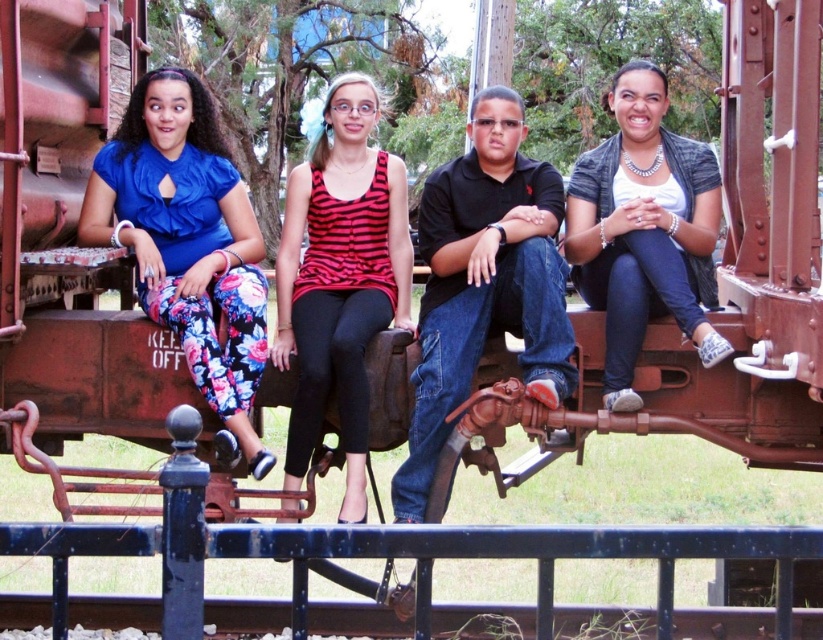
You are standing near the blue painted metal rail at lower center and want to hand a drink to the person wearing the striped fabric tank top at center. Can you reach them without moving from your current position?

The striped fabric tank top at center is to the left of the blue painted metal rail at lower center, so you can reach them without moving from your current position.